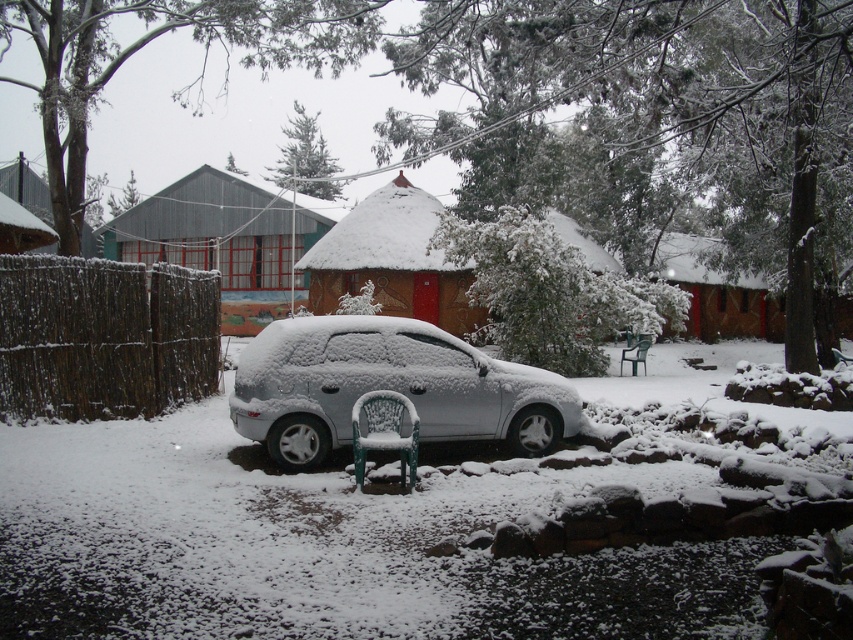
Is point (257, 256) in front of point (424, 296)?

No, (257, 256) is behind (424, 296).

Where is `wooden thatched hut at center`? The height and width of the screenshot is (640, 853). wooden thatched hut at center is located at coordinates (221, 241).

Does point (244, 403) come farther from viewer compared to point (422, 224)?

That is False.

Locate an element on the screen. white matte car at center is located at coordinates (387, 387).

Is point (277, 387) more distant than point (460, 288)?

No, (277, 387) is closer to viewer.

This screenshot has height=640, width=853. I want to click on white matte car at center, so click(x=387, y=387).

Does white matte car at center appear under wooden thatched hut at center?

Yes.

Can you confirm if white matte car at center is bigger than wooden thatched hut at center?

Actually, white matte car at center might be smaller than wooden thatched hut at center.

What do you see at coordinates (387, 387) in the screenshot?
I see `white matte car at center` at bounding box center [387, 387].

The height and width of the screenshot is (640, 853). In order to click on white matte car at center in this screenshot , I will do `click(387, 387)`.